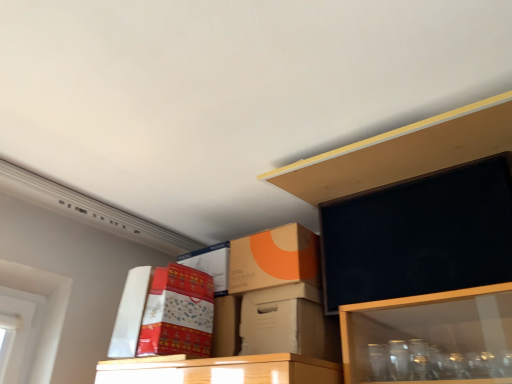
Question: Based on their sizes in the image, would you say matte cardboard box at upper center is bigger or smaller than orange matte cardboard box at upper center, which is the second box in left-to-right order?

Choices:
 (A) small
 (B) big

Answer: (A)

Question: Is matte cardboard box at upper center situated inside orange matte cardboard box at upper center, which is the second box in left-to-right order, or outside?

Choices:
 (A) outside
 (B) inside

Answer: (A)

Question: Estimate the real-world distances between objects in this image. Which object is farther from the orange matte cardboard box at upper center, positioned as the second box in right-to-left order?

Choices:
 (A) natural wood shelf at upper center
 (B) white cardboard box at center, which is the 1th box from right to left
 (C) white cardboard box at upper left, which ranks as the 1th box in left-to-right order
 (D) matte cardboard box at upper center

Answer: (C)

Question: Considering the real-world distances, which object is farthest from the orange matte cardboard box at upper center, which is the second box in left-to-right order?

Choices:
 (A) white cardboard box at upper left, which ranks as the 1th box in left-to-right order
 (B) natural wood shelf at upper center
 (C) matte cardboard box at upper center
 (D) white cardboard box at center, which is the 1th box from right to left

Answer: (A)